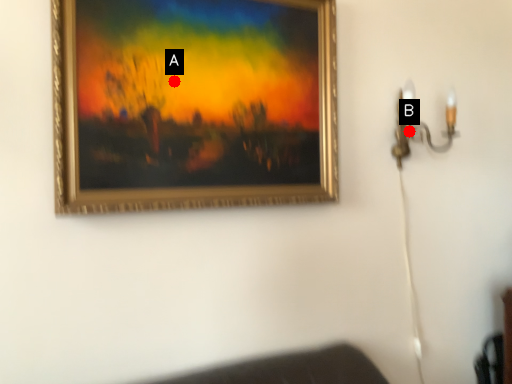
Question: Two points are circled on the image, labeled by A and B beside each circle. Which point is closer to the camera?

Choices:
 (A) A is closer
 (B) B is closer

Answer: (A)